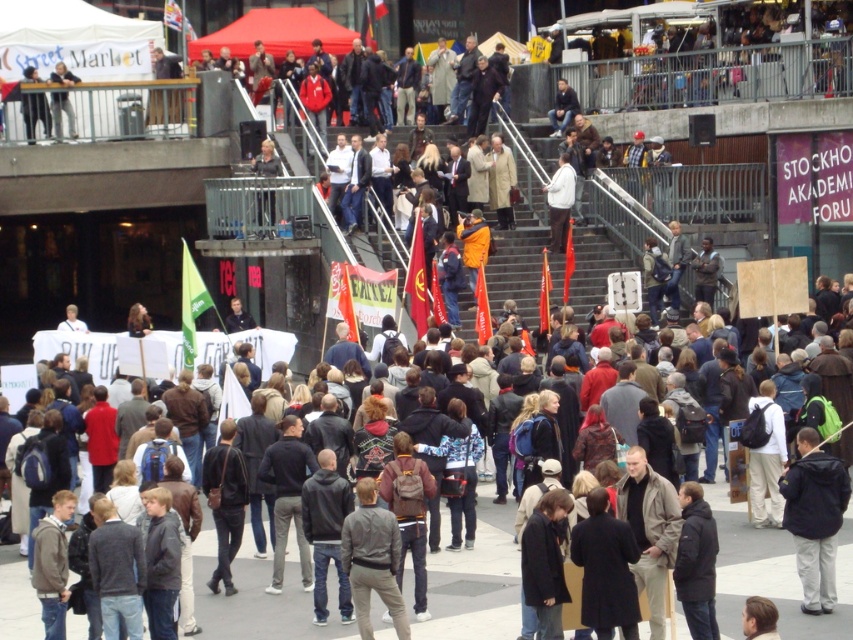
Question: Among these points, which one is farthest from the camera?

Choices:
 (A) (55, 92)
 (B) (827, 540)

Answer: (A)

Question: Can you confirm if dark gray sweater at center is positioned to the left of black leather jacket at center?

Choices:
 (A) yes
 (B) no

Answer: (B)

Question: Which object appears farthest from the camera in this image?

Choices:
 (A) black leather jacket at center
 (B) dark gray sweater at center

Answer: (A)

Question: Is white matte jacket at center to the right of matte black camera at upper left from the viewer's perspective?

Choices:
 (A) yes
 (B) no

Answer: (A)

Question: Is black leather jacket at center positioned at the back of dark gray jacket at upper left?

Choices:
 (A) no
 (B) yes

Answer: (A)

Question: Considering the real-world distances, which object is closest to the dark gray jacket at upper left?

Choices:
 (A) black leather jacket at center
 (B) dark gray sweater at center
 (C) white matte jacket at center
 (D) black fabric jacket at lower right

Answer: (C)